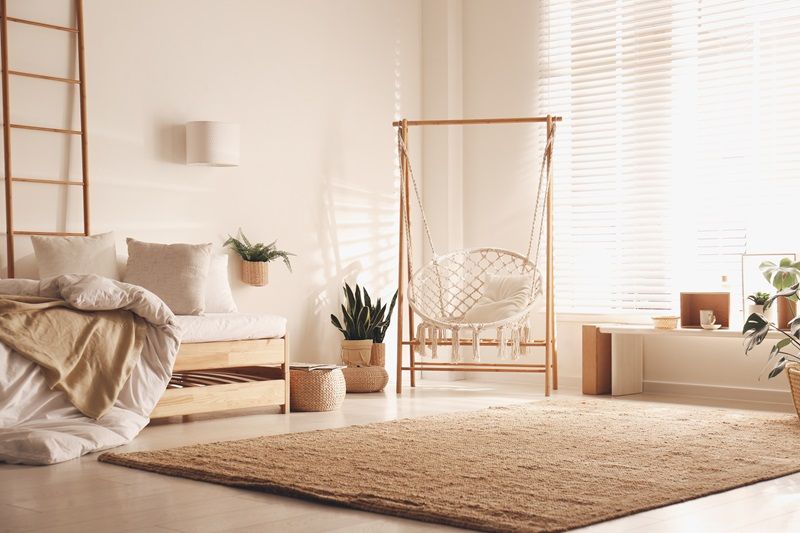
The width and height of the screenshot is (800, 533). I want to click on pillow on chair, so 501,286.